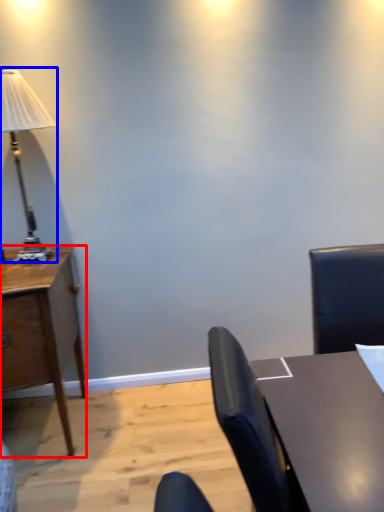
Question: Among these objects, which one is nearest to the camera, desk (highlighted by a red box) or lamp (highlighted by a blue box)?

Choices:
 (A) desk
 (B) lamp

Answer: (A)